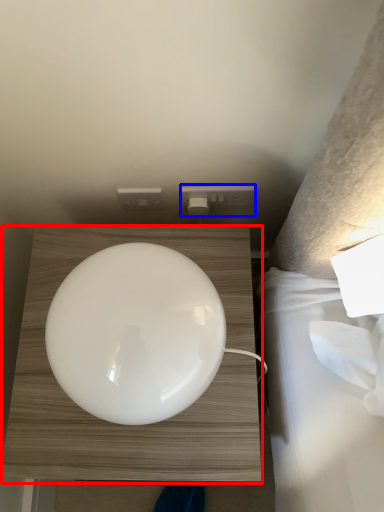
Question: Which of the following is the closest to the observer, furniture (highlighted by a red box) or electric outlet (highlighted by a blue box)?

Choices:
 (A) furniture
 (B) electric outlet

Answer: (A)